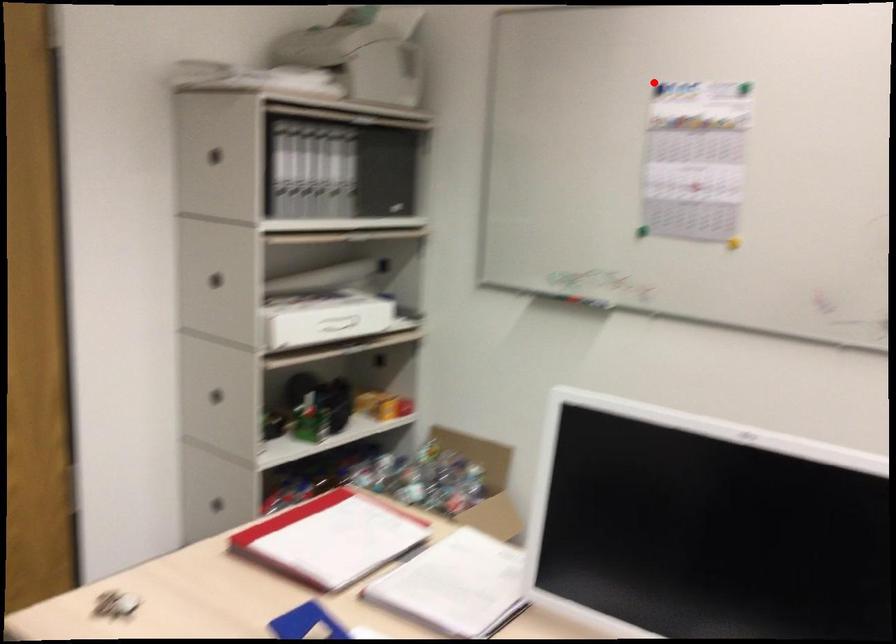
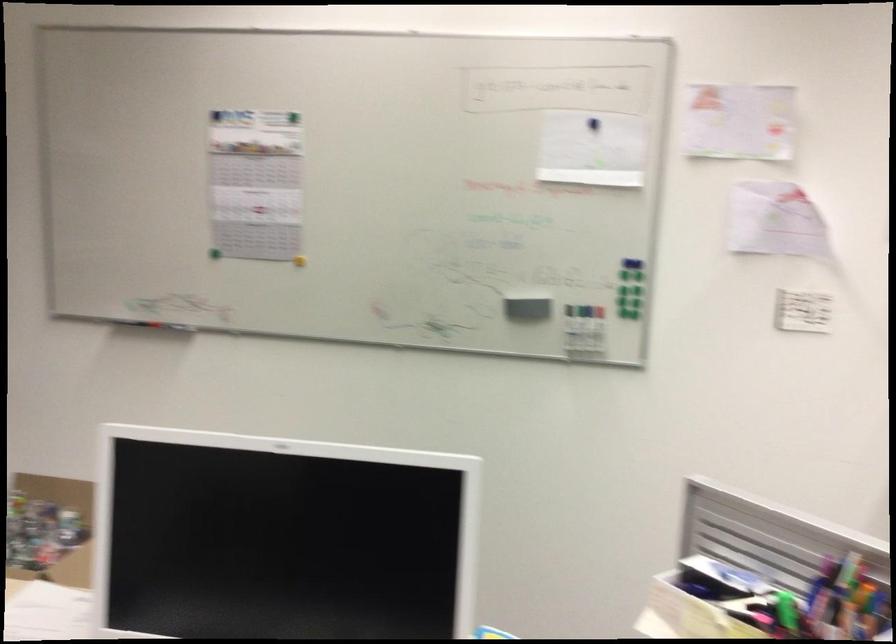
In the second image, find the point that corresponds to the highlighted location in the first image.

(216, 116)